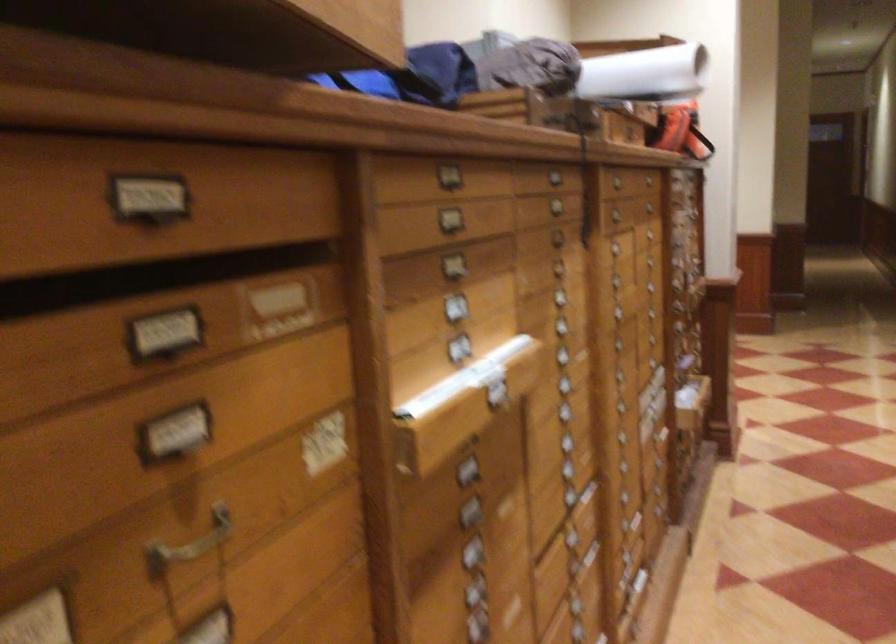
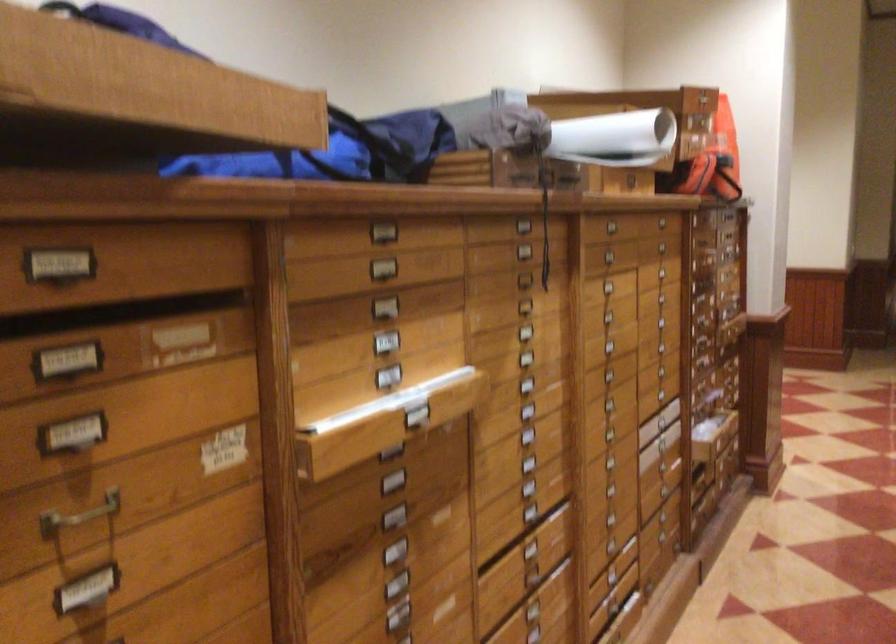
Find the pixel in the second image that matches pixel 186 536 in the first image.

(79, 515)